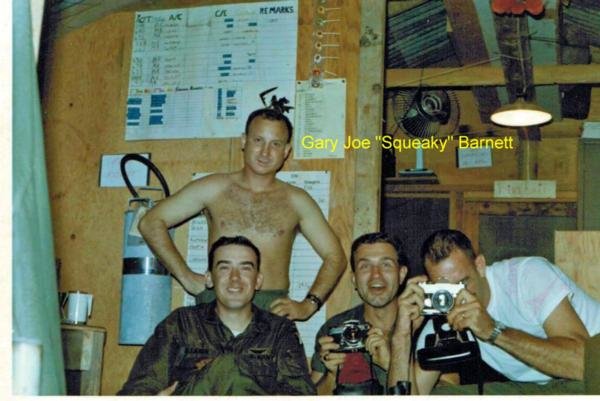
Locate an element on the screen. blue panel is located at coordinates (148, 292), (139, 255).